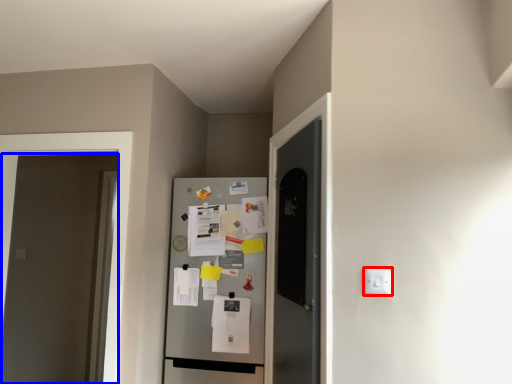
Question: Which of the following is the farthest to the observer, electric outlet (highlighted by a red box) or door (highlighted by a blue box)?

Choices:
 (A) electric outlet
 (B) door

Answer: (B)